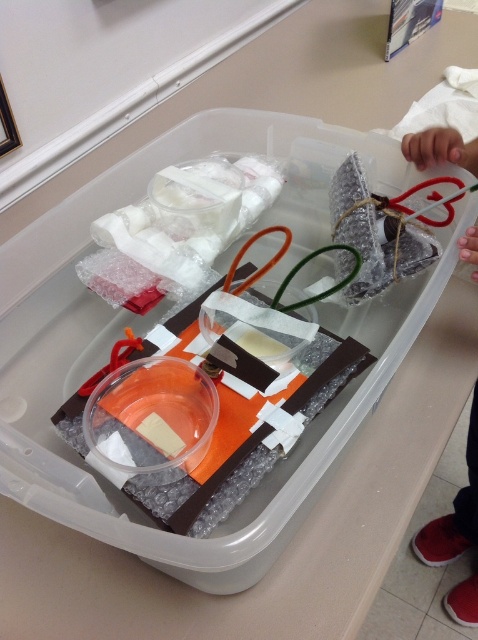
Is white bubble wrap at center to the left of matte plastic heart at upper right from the viewer's perspective?

Indeed, white bubble wrap at center is positioned on the left side of matte plastic heart at upper right.

How distant is white bubble wrap at center from matte plastic heart at upper right?

white bubble wrap at center and matte plastic heart at upper right are 25.63 inches apart from each other.

The width and height of the screenshot is (478, 640). What do you see at coordinates (177, 230) in the screenshot? I see `white bubble wrap at center` at bounding box center [177, 230].

I want to click on white bubble wrap at center, so click(x=177, y=230).